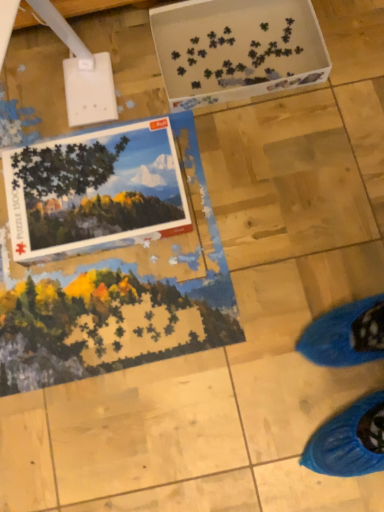
Question: From the image's perspective, is white plastic puzzle pieces at upper center above or below matte cardboard puzzle box at upper left?

Choices:
 (A) below
 (B) above

Answer: (B)

Question: In terms of width, does white plastic puzzle pieces at upper center look wider or thinner when compared to matte cardboard puzzle box at upper left?

Choices:
 (A) wide
 (B) thin

Answer: (A)

Question: From a real-world perspective, is white plastic puzzle pieces at upper center physically located above or below matte cardboard puzzle box at upper left?

Choices:
 (A) below
 (B) above

Answer: (A)

Question: From a real-world perspective, is matte cardboard puzzle box at upper left above or below white plastic puzzle pieces at upper center?

Choices:
 (A) above
 (B) below

Answer: (A)

Question: Is matte cardboard puzzle box at upper left in front of or behind white plastic puzzle pieces at upper center in the image?

Choices:
 (A) front
 (B) behind

Answer: (A)

Question: In terms of height, does matte cardboard puzzle box at upper left look taller or shorter compared to white plastic puzzle pieces at upper center?

Choices:
 (A) tall
 (B) short

Answer: (B)

Question: Considering the positions of point (26, 170) and point (266, 28), is point (26, 170) closer or farther from the camera than point (266, 28)?

Choices:
 (A) closer
 (B) farther

Answer: (A)